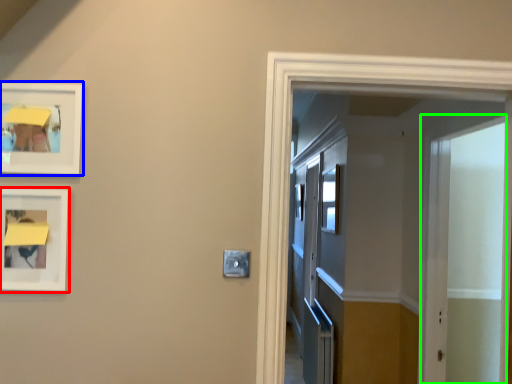
Question: Estimate the real-world distances between objects in this image. Which object is closer to picture frame (highlighted by a red box), picture frame (highlighted by a blue box) or screen door (highlighted by a green box)?

Choices:
 (A) picture frame
 (B) screen door

Answer: (A)